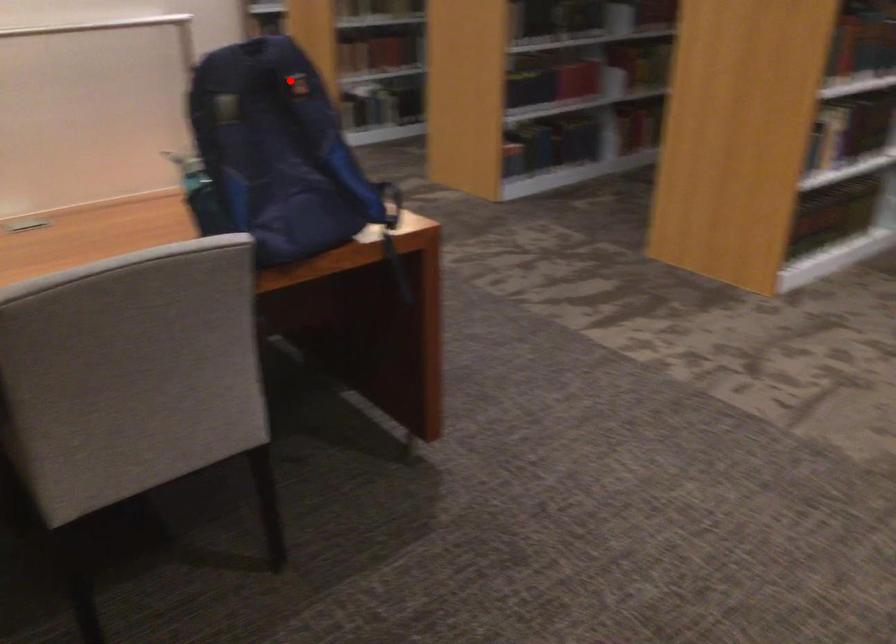
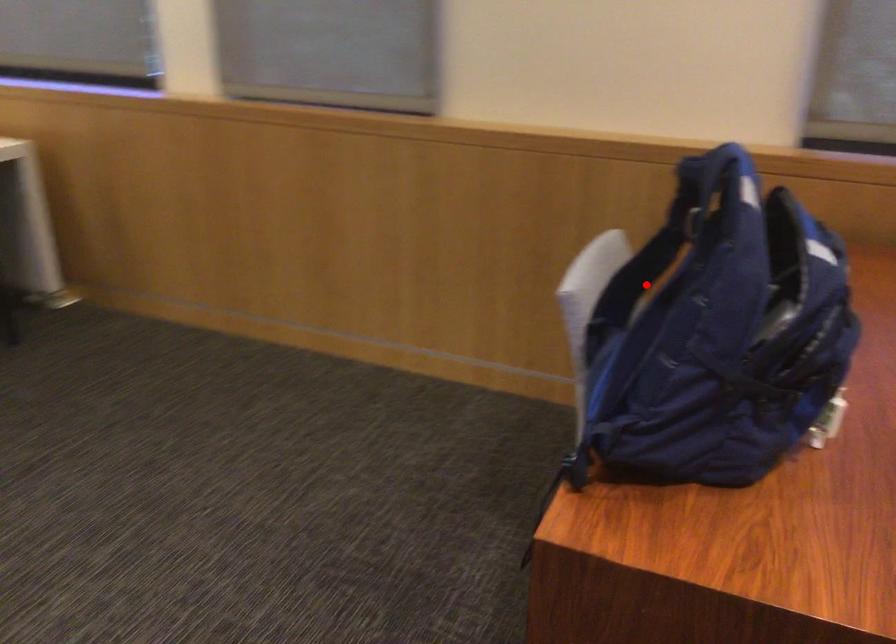
I am providing you with two images of the same scene from different viewpoints. A red point is marked on the first image and another point is marked on the second image. Is the red point in image1 aligned with the point shown in image2?

No